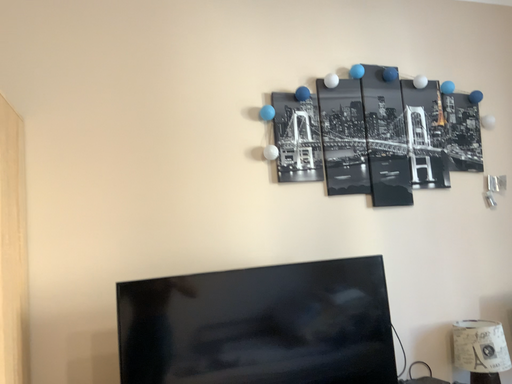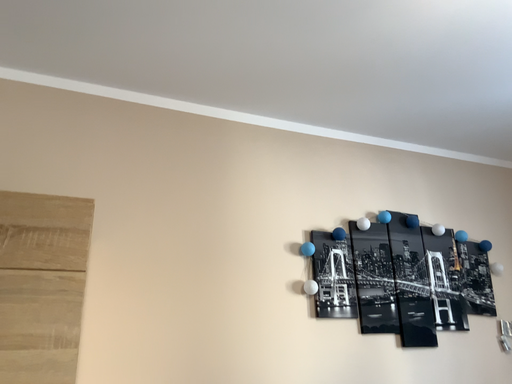
Question: How did the camera likely rotate when shooting the video?

Choices:
 (A) rotated upward
 (B) rotated downward

Answer: (A)